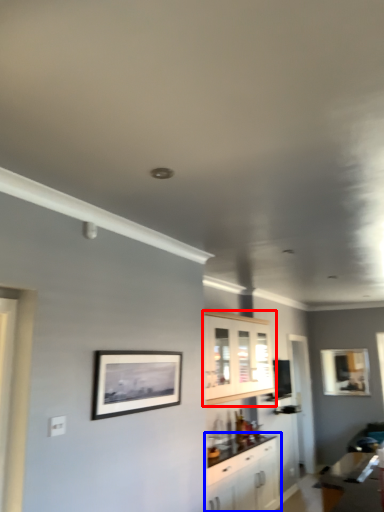
Question: Which point is further to the camera, cabinetry (highlighted by a red box) or cabinetry (highlighted by a blue box)?

Choices:
 (A) cabinetry
 (B) cabinetry

Answer: (A)